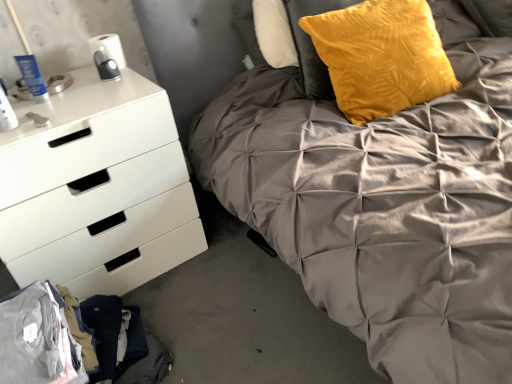
Question: Is white matte chest of drawers at left turned away from velvet yellow pillow at upper right?

Choices:
 (A) no
 (B) yes

Answer: (A)

Question: Is white matte chest of drawers at left taller than velvet yellow pillow at upper right?

Choices:
 (A) yes
 (B) no

Answer: (A)

Question: Considering the relative sizes of white matte chest of drawers at left and velvet yellow pillow at upper right in the image provided, is white matte chest of drawers at left shorter than velvet yellow pillow at upper right?

Choices:
 (A) yes
 (B) no

Answer: (B)

Question: Would you consider white matte chest of drawers at left to be distant from velvet yellow pillow at upper right?

Choices:
 (A) no
 (B) yes

Answer: (A)

Question: Is white matte chest of drawers at left aimed at velvet yellow pillow at upper right?

Choices:
 (A) yes
 (B) no

Answer: (B)

Question: Does white matte chest of drawers at left have a larger size compared to velvet yellow pillow at upper right?

Choices:
 (A) yes
 (B) no

Answer: (A)

Question: Is matte gray quilted bed at center turned away from velvet yellow pillow at upper right?

Choices:
 (A) yes
 (B) no

Answer: (A)

Question: Does matte gray quilted bed at center appear on the left side of velvet yellow pillow at upper right?

Choices:
 (A) yes
 (B) no

Answer: (B)

Question: Is matte gray quilted bed at center in contact with velvet yellow pillow at upper right?

Choices:
 (A) no
 (B) yes

Answer: (A)

Question: Does matte gray quilted bed at center have a larger size compared to velvet yellow pillow at upper right?

Choices:
 (A) no
 (B) yes

Answer: (B)

Question: From the image's perspective, is matte gray quilted bed at center on velvet yellow pillow at upper right?

Choices:
 (A) no
 (B) yes

Answer: (A)

Question: Can you confirm if matte gray quilted bed at center is smaller than velvet yellow pillow at upper right?

Choices:
 (A) no
 (B) yes

Answer: (A)

Question: Is matte gray quilted bed at center a part of velvet yellow pillow at upper right?

Choices:
 (A) no
 (B) yes

Answer: (A)